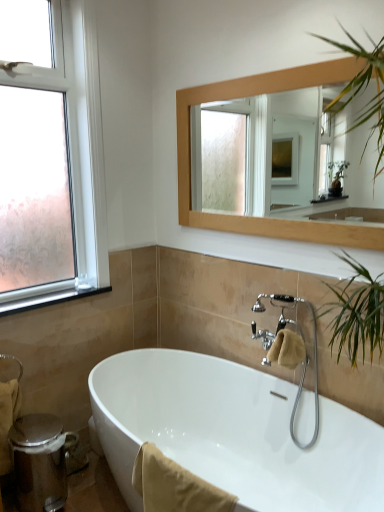
Question: Should I look upward or downward to see beige cotton towel at lower center, the second bath towel from the left?

Choices:
 (A) down
 (B) up

Answer: (A)

Question: Is beige cotton towel at lower left, which ranks as the first bath towel in back-to-front order, surrounding clear glass window at upper left?

Choices:
 (A) no
 (B) yes

Answer: (A)

Question: Considering the relative sizes of beige cotton towel at lower left, which is the third bath towel in front-to-back order, and clear glass window at upper left in the image provided, is beige cotton towel at lower left, which is the third bath towel in front-to-back order, shorter than clear glass window at upper left?

Choices:
 (A) yes
 (B) no

Answer: (A)

Question: Is beige cotton towel at lower left, the third bath towel when ordered from right to left, positioned in front of clear glass window at upper left?

Choices:
 (A) no
 (B) yes

Answer: (A)

Question: Is beige cotton towel at lower left, which is the third bath towel in front-to-back order, taller than clear glass window at upper left?

Choices:
 (A) yes
 (B) no

Answer: (B)

Question: Can you confirm if beige cotton towel at lower left, placed as the 1th bath towel when sorted from left to right, is bigger than clear glass window at upper left?

Choices:
 (A) yes
 (B) no

Answer: (B)

Question: Can you confirm if clear glass window at upper left is thinner than beige cotton towel at lower left, the third bath towel when ordered from right to left?

Choices:
 (A) no
 (B) yes

Answer: (A)

Question: From a real-world perspective, does clear glass window at upper left stand above beige cotton towel at lower left, which ranks as the first bath towel in back-to-front order?

Choices:
 (A) no
 (B) yes

Answer: (B)

Question: Is clear glass window at upper left oriented towards beige cotton towel at lower left, which is the third bath towel in front-to-back order?

Choices:
 (A) no
 (B) yes

Answer: (A)

Question: Is clear glass window at upper left positioned before beige cotton towel at lower left, the third bath towel when ordered from right to left?

Choices:
 (A) no
 (B) yes

Answer: (B)

Question: Is beige cotton towel at lower left, which ranks as the first bath towel in back-to-front order, surrounded by clear glass window at upper left?

Choices:
 (A) yes
 (B) no

Answer: (B)

Question: From the image's perspective, is clear glass window at upper left on beige cotton towel at lower left, which ranks as the first bath towel in back-to-front order?

Choices:
 (A) no
 (B) yes

Answer: (B)

Question: Is clear glass window at upper left thinner than beige cotton towel at lower center, the second bath towel from the left?

Choices:
 (A) yes
 (B) no

Answer: (B)